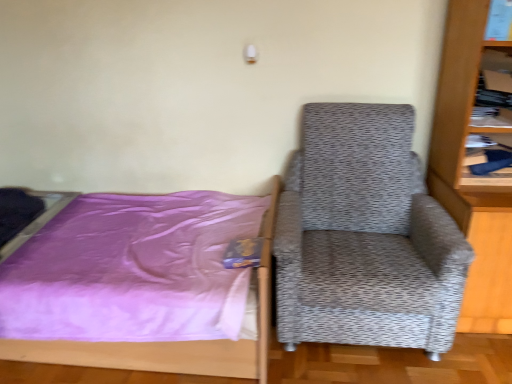
Question: From the image's perspective, is wooden bookshelf at upper right located beneath wooden bookcase at right?

Choices:
 (A) yes
 (B) no

Answer: (B)

Question: Is wooden bookshelf at upper right not near wooden bookcase at right?

Choices:
 (A) no
 (B) yes

Answer: (A)

Question: Considering the relative sizes of wooden bookshelf at upper right and wooden bookcase at right in the image provided, is wooden bookshelf at upper right shorter than wooden bookcase at right?

Choices:
 (A) no
 (B) yes

Answer: (B)

Question: Is wooden bookcase at right surrounded by wooden bookshelf at upper right?

Choices:
 (A) no
 (B) yes

Answer: (A)

Question: Can you confirm if wooden bookshelf at upper right is bigger than wooden bookcase at right?

Choices:
 (A) no
 (B) yes

Answer: (A)

Question: Considering the positions of wooden bookshelf at upper right and wooden bookcase at right in the image, is wooden bookshelf at upper right taller or shorter than wooden bookcase at right?

Choices:
 (A) tall
 (B) short

Answer: (B)

Question: From the image's perspective, is wooden bookshelf at upper right above or below wooden bookcase at right?

Choices:
 (A) above
 (B) below

Answer: (A)

Question: Would you say wooden bookshelf at upper right is to the left or to the right of wooden bookcase at right in the picture?

Choices:
 (A) left
 (B) right

Answer: (A)

Question: Choose the correct answer: Is wooden bookshelf at upper right inside wooden bookcase at right or outside it?

Choices:
 (A) outside
 (B) inside

Answer: (B)

Question: From a real-world perspective, relative to purple satin bed at left, is wooden bookcase at right vertically above or below?

Choices:
 (A) below
 (B) above

Answer: (B)

Question: From the image's perspective, is wooden bookcase at right above or below purple satin bed at left?

Choices:
 (A) above
 (B) below

Answer: (A)

Question: Considering the positions of wooden bookcase at right and purple satin bed at left in the image, is wooden bookcase at right bigger or smaller than purple satin bed at left?

Choices:
 (A) big
 (B) small

Answer: (B)

Question: In the image, is wooden bookcase at right positioned in front of or behind purple satin bed at left?

Choices:
 (A) behind
 (B) front

Answer: (B)

Question: From the image's perspective, is purple satin bed at left located above or below gray textured armchair at right?

Choices:
 (A) below
 (B) above

Answer: (A)

Question: From a real-world perspective, is purple satin bed at left positioned above or below gray textured armchair at right?

Choices:
 (A) above
 (B) below

Answer: (B)